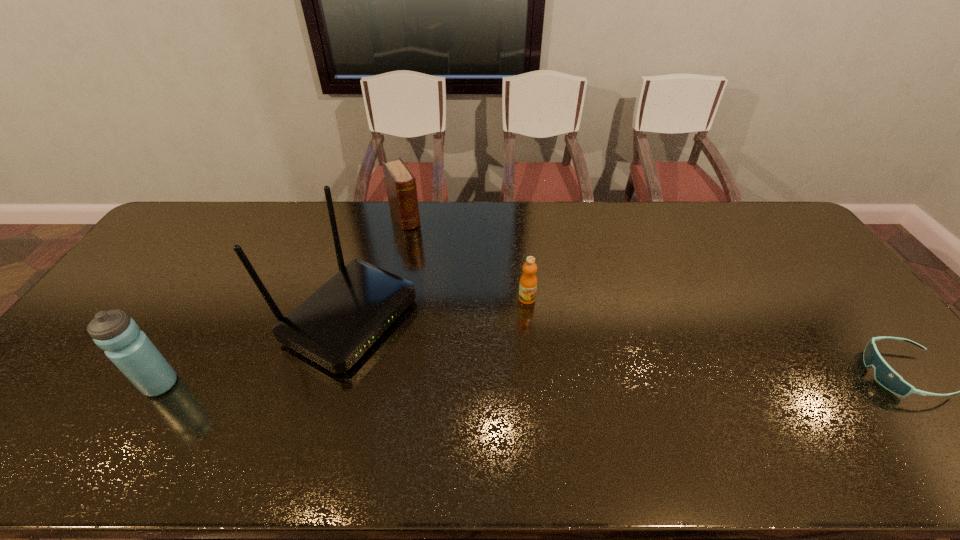
Locate an element on the screen. The height and width of the screenshot is (540, 960). the fourth shortest object is located at coordinates (132, 352).

I want to click on the leftmost object, so click(132, 352).

At what (x,y) coordinates should I click in order to perform the action: click on the tallest object. Please return your answer as a coordinate pair (x, y). This screenshot has width=960, height=540. Looking at the image, I should click on (340, 321).

The height and width of the screenshot is (540, 960). Find the location of `the farthest object`. the farthest object is located at coordinates (400, 182).

At what (x,y) coordinates should I click in order to perform the action: click on the third shortest object. Please return your answer as a coordinate pair (x, y). This screenshot has width=960, height=540. Looking at the image, I should click on (400, 182).

The height and width of the screenshot is (540, 960). Identify the location of the fourth tallest object. (528, 282).

You are a GUI agent. You are given a task and a screenshot of the screen. Output one action in this format:
    pyautogui.click(x=<x>, y=<y>)
    Task: Click on the orange juice
    
    Given the screenshot: What is the action you would take?
    pyautogui.click(x=528, y=282)

Locate an element on the screen. vacant space located on the back of the leftmost object is located at coordinates (196, 325).

At what (x,y) coordinates should I click in order to perform the action: click on free point located on the front-facing side of the router. Please return your answer as a coordinate pair (x, y). The height and width of the screenshot is (540, 960). Looking at the image, I should click on (533, 414).

This screenshot has width=960, height=540. I want to click on free space located 0.220m on the front-facing side of the router, so coord(471,383).